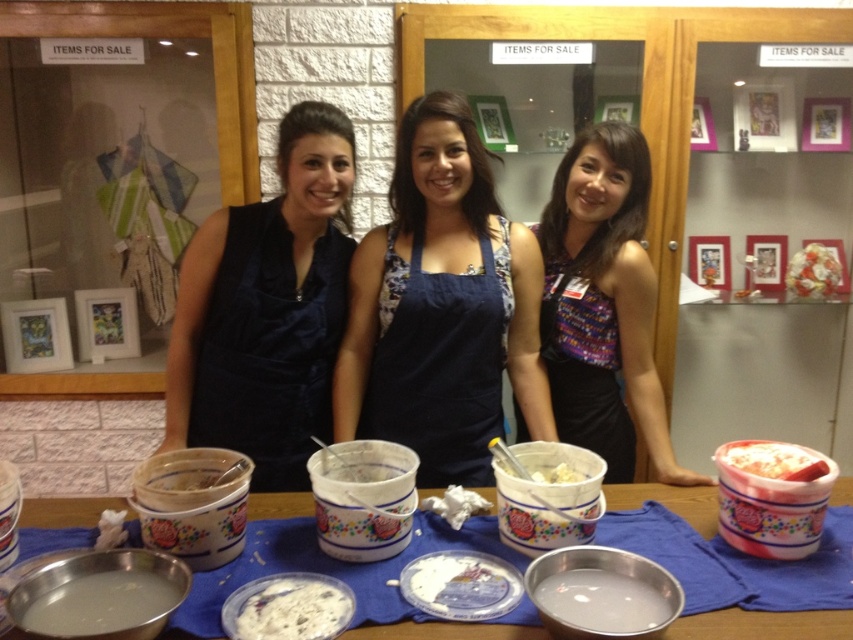
Between patterned fabric apron at center and white matte liquid at lower center, which one appears on the left side from the viewer's perspective?

white matte liquid at lower center

Does patterned fabric apron at center appear on the left side of white matte liquid at lower center?

In fact, patterned fabric apron at center is to the right of white matte liquid at lower center.

Where is `patterned fabric apron at center`? This screenshot has height=640, width=853. patterned fabric apron at center is located at coordinates (584, 392).

Does dark blue corduroy apron at center appear over white creamy paste at center?

Yes.

Which is more to the left, dark blue corduroy apron at center or white creamy paste at center?

From the viewer's perspective, white creamy paste at center appears more on the left side.

Locate an element on the screen. The image size is (853, 640). dark blue corduroy apron at center is located at coordinates (439, 368).

Is point (308, 138) closer to camera compared to point (550, 481)?

No, it is not.

Does matte blue dress at center appear over white creamy ice cream at center?

Indeed, matte blue dress at center is positioned over white creamy ice cream at center.

Locate an element on the screen. This screenshot has height=640, width=853. matte blue dress at center is located at coordinates (267, 308).